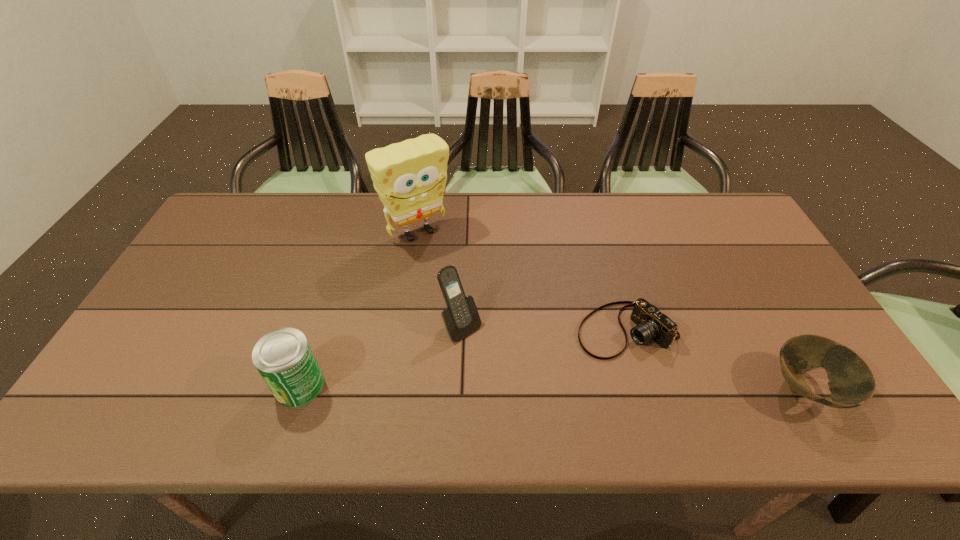
Locate an element on the screen. This screenshot has width=960, height=540. free point located on the left of the second shortest object is located at coordinates (746, 389).

The image size is (960, 540). I want to click on vacant region located on the face of the sponge, so click(x=463, y=283).

Locate an element on the screen. free region located 0.070m on the face of the sponge is located at coordinates (446, 262).

Where is `free space located on the face of the sponge`? free space located on the face of the sponge is located at coordinates (458, 276).

Locate an element on the screen. The image size is (960, 540). free region located on the front-facing side of the cellular telephone is located at coordinates (504, 373).

Where is `free point located 0.190m on the front-facing side of the cellular telephone`? The height and width of the screenshot is (540, 960). free point located 0.190m on the front-facing side of the cellular telephone is located at coordinates (523, 393).

The height and width of the screenshot is (540, 960). What are the coordinates of `vacant space located on the front-facing side of the cellular telephone` in the screenshot? It's located at (510, 378).

Image resolution: width=960 pixels, height=540 pixels. Find the location of `free region located 0.200m on the front-facing side of the camera`. free region located 0.200m on the front-facing side of the camera is located at coordinates (522, 382).

Where is `free space located 0.250m on the front-facing side of the camera`? The height and width of the screenshot is (540, 960). free space located 0.250m on the front-facing side of the camera is located at coordinates (505, 393).

Identify the location of object that is positioned at the far edge. (410, 177).